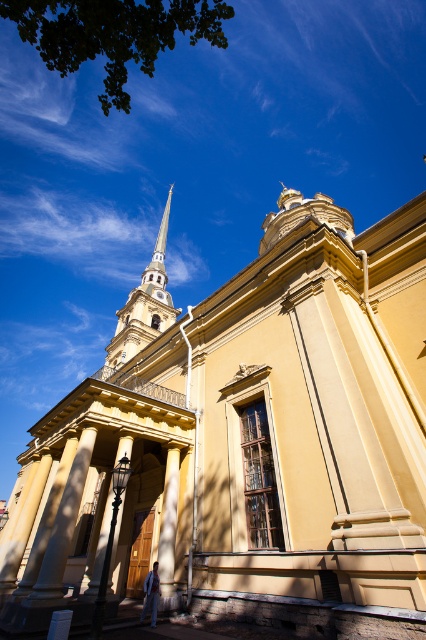
Can you confirm if yellow matte church at center is positioned below smooth beige column at lower left?

Actually, yellow matte church at center is above smooth beige column at lower left.

How distant is yellow matte church at center from smooth beige column at lower left?

The distance of yellow matte church at center from smooth beige column at lower left is 13.88 meters.

Is point (336, 509) less distant than point (60, 548)?

Yes, point (336, 509) is closer to viewer.

The image size is (426, 640). Find the location of `yellow matte church at center`. yellow matte church at center is located at coordinates (247, 442).

Does smooth beige pillar at center appear over polished silver spire at upper center?

No, smooth beige pillar at center is not above polished silver spire at upper center.

Does point (169, 536) come behind point (158, 282)?

No, (169, 536) is in front of (158, 282).

Locate an element on the screen. smooth beige pillar at center is located at coordinates (169, 531).

Which is in front, point (175, 442) or point (164, 221)?

Positioned in front is point (175, 442).

Which is in front, point (265, 481) or point (111, 340)?

Point (265, 481) is in front.

Locate an element on the screen. The width and height of the screenshot is (426, 640). yellow matte church at center is located at coordinates (247, 442).